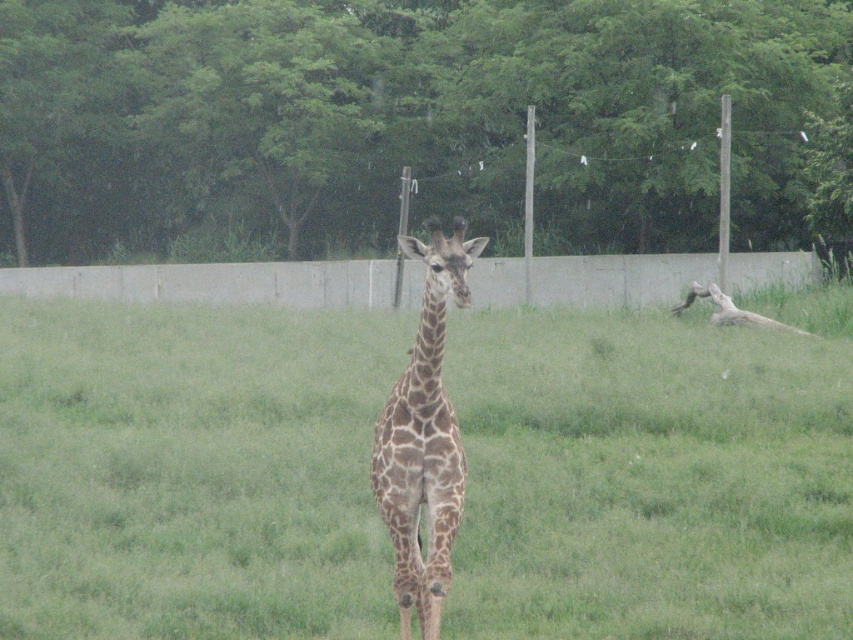
You are a zookeeper who needs to feed the brown spotted giraffe at center. The food is placed on the gray concrete fence at center. Can you safely reach the food from the giraffe without crossing the fence?

The distance between the gray concrete fence at center and the brown spotted giraffe at center is 9.45 meters. Since the giraffe cannot jump or climb over the fence, it cannot reach the food placed on the gray concrete fence at center.

You are a zookeeper planning to feed the brown spotted giraffe at center. There is a fallen tree trunk on the right side of the image. To reach the giraffe without stepping on the trunk, which direction should you approach from relative to the green leafy tree at upper center?

The green leafy tree at upper center is to the left of the brown spotted giraffe at center. Therefore, to approach the brown spotted giraffe at center without stepping on the fallen tree trunk on the right, you should come from the left side of the green leafy tree at upper center.

Based on the photo, you are a zookeeper who needs to place a new feeding station between the green leafy tree at upper center and the gray concrete fence at center. The feeding station requires a minimum of 10 feet of space to be safely placed. Based on the scene, can you determine if there is enough space between them to install the feeding station?

The green leafy tree at upper center is 12.73 feet away from the gray concrete fence at center, which is more than the required 10 feet. Therefore, there is enough space to safely install the feeding station between them.